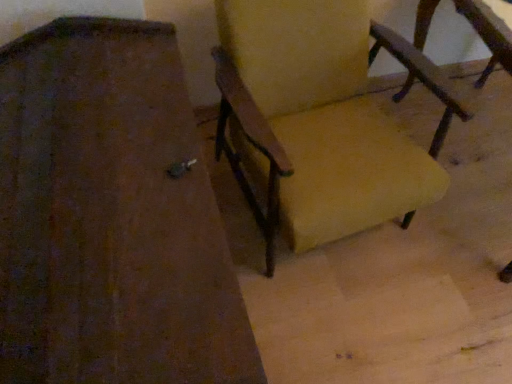
Question: Can you confirm if yellow fabric chair at center, marked as the 2th chair in a left-to-right arrangement, is taller than wooden chair at right, the second chair positioned from the right?

Choices:
 (A) no
 (B) yes

Answer: (B)

Question: Is yellow fabric chair at center, the first chair in the right-to-left sequence, aimed at wooden chair at right, the second chair positioned from the right?

Choices:
 (A) no
 (B) yes

Answer: (A)

Question: Would you consider yellow fabric chair at center, marked as the 2th chair in a left-to-right arrangement, to be distant from wooden chair at right, the second chair positioned from the right?

Choices:
 (A) yes
 (B) no

Answer: (B)

Question: From a real-world perspective, is yellow fabric chair at center, the first chair in the right-to-left sequence, physically below wooden chair at right, the second chair positioned from the right?

Choices:
 (A) no
 (B) yes

Answer: (A)

Question: Is yellow fabric chair at center, marked as the 2th chair in a left-to-right arrangement, further to the viewer compared to wooden chair at right, the second chair positioned from the right?

Choices:
 (A) no
 (B) yes

Answer: (B)

Question: Is yellow fabric chair at center, marked as the 2th chair in a left-to-right arrangement, wider than wooden chair at right, the second chair positioned from the right?

Choices:
 (A) yes
 (B) no

Answer: (B)

Question: Is wooden chair at right, the second chair positioned from the right, behind yellow fabric chair at center, marked as the 2th chair in a left-to-right arrangement?

Choices:
 (A) no
 (B) yes

Answer: (A)

Question: Is wooden chair at right, which appears as the 1th chair when viewed from the left, outside of yellow fabric chair at center, marked as the 2th chair in a left-to-right arrangement?

Choices:
 (A) yes
 (B) no

Answer: (A)

Question: From the image's perspective, is wooden chair at right, which appears as the 1th chair when viewed from the left, located above yellow fabric chair at center, the first chair in the right-to-left sequence?

Choices:
 (A) yes
 (B) no

Answer: (B)

Question: Is yellow fabric chair at center, the first chair in the right-to-left sequence, located within wooden chair at right, which appears as the 1th chair when viewed from the left?

Choices:
 (A) no
 (B) yes

Answer: (A)

Question: Is wooden chair at right, the second chair positioned from the right, oriented towards yellow fabric chair at center, marked as the 2th chair in a left-to-right arrangement?

Choices:
 (A) no
 (B) yes

Answer: (A)

Question: From the image's perspective, is wooden chair at right, which appears as the 1th chair when viewed from the left, beneath yellow fabric chair at center, the first chair in the right-to-left sequence?

Choices:
 (A) no
 (B) yes

Answer: (B)

Question: Is wooden chair at right, the second chair positioned from the right, wider or thinner than yellow fabric chair at center, the first chair in the right-to-left sequence?

Choices:
 (A) wide
 (B) thin

Answer: (A)